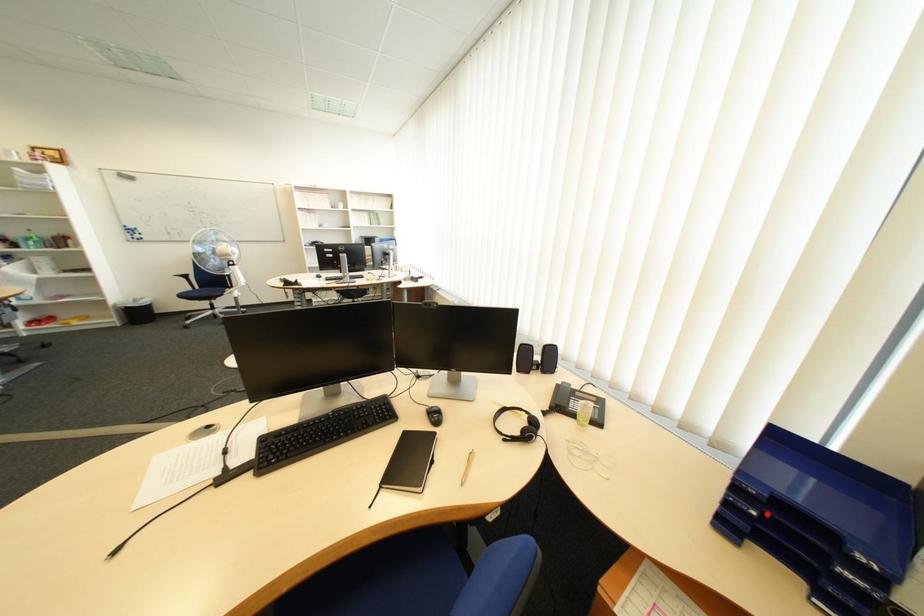
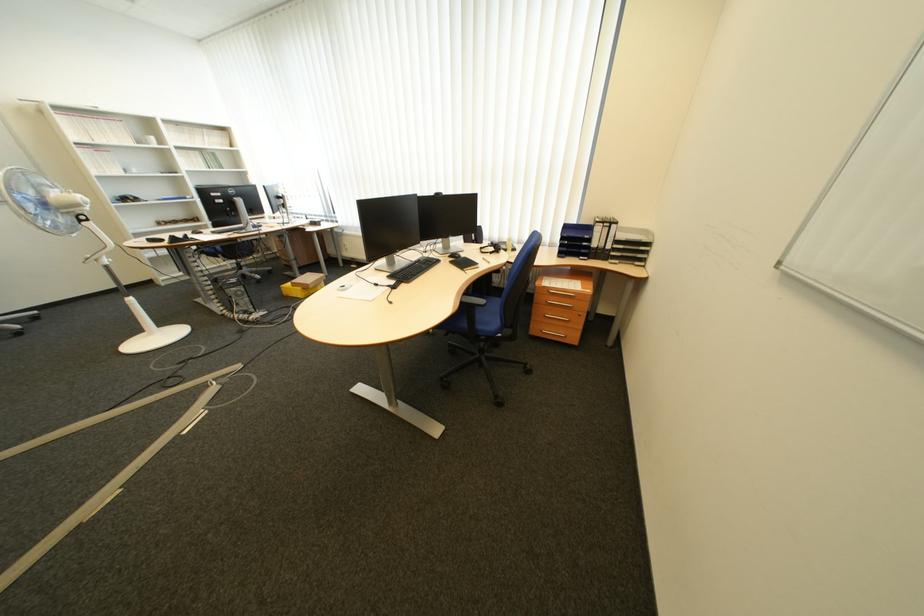
The point at the highlighted location is marked in the first image. Where is the corresponding point in the second image?

(579, 244)